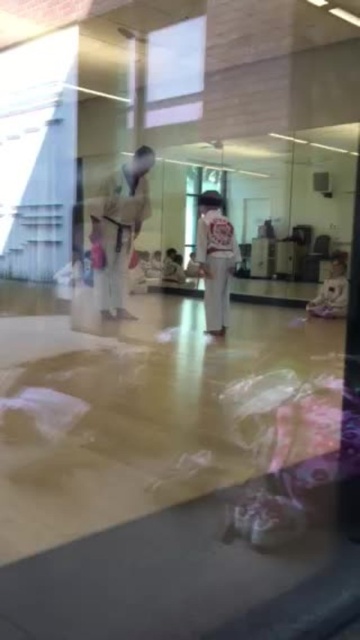
Question: Is white karate uniform at center above white cotton karate uniform at center?

Choices:
 (A) no
 (B) yes

Answer: (B)

Question: Can you confirm if white cotton karate uniform at center is bigger than white cotton shirt at right?

Choices:
 (A) yes
 (B) no

Answer: (B)

Question: Which point appears farthest from the camera in this image?

Choices:
 (A) (101, 285)
 (B) (205, 248)

Answer: (A)

Question: Can you confirm if white karate uniform at center is thinner than white cotton shirt at right?

Choices:
 (A) no
 (B) yes

Answer: (A)

Question: Which of the following is the closest to the observer?

Choices:
 (A) (317, 310)
 (B) (227, 298)

Answer: (B)

Question: Which point is farther to the camera?

Choices:
 (A) white karate uniform at center
 (B) white cotton shirt at right

Answer: (B)